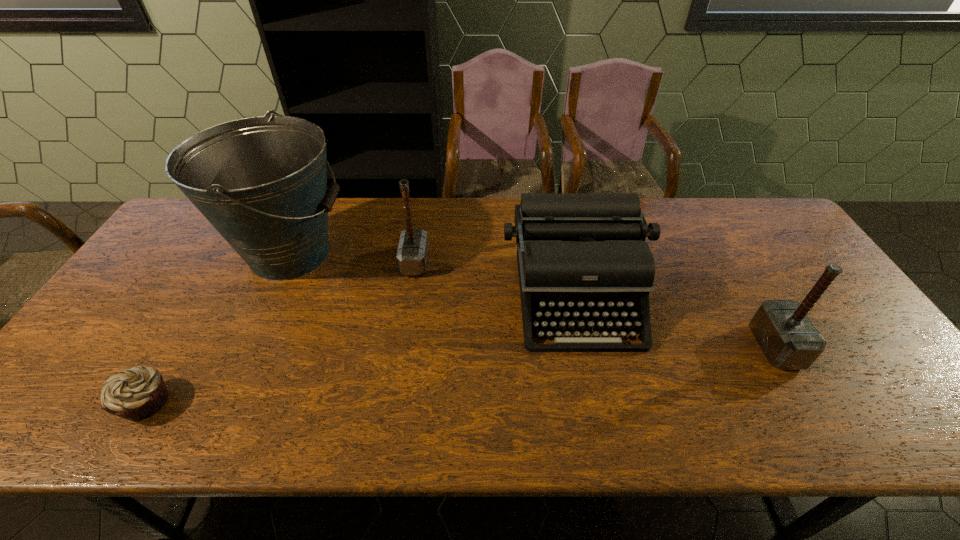
Locate an element on the screen. The height and width of the screenshot is (540, 960). blank space located 0.110m on the striking surface of the third object from left to right is located at coordinates (465, 262).

Find the location of `free point located 0.050m on the back of the rightmost object`. free point located 0.050m on the back of the rightmost object is located at coordinates (753, 309).

What are the coordinates of `vacant space located 0.130m on the typing side of the fourth tallest object` in the screenshot? It's located at (599, 400).

I want to click on vacant space situated on the left of the shortest object, so click(x=60, y=402).

Where is `object that is at the far edge`? object that is at the far edge is located at coordinates (261, 181).

You are a GUI agent. You are given a task and a screenshot of the screen. Output one action in this format:
    pyautogui.click(x=<x>, y=<y>)
    Task: Click on the object present at the near edge
    
    Given the screenshot: What is the action you would take?
    pyautogui.click(x=138, y=393)

Where is `free space at the far edge of the desktop`? This screenshot has width=960, height=540. free space at the far edge of the desktop is located at coordinates (399, 226).

Locate an element on the screen. The image size is (960, 540). free space at the near edge of the desktop is located at coordinates (843, 408).

Identify the location of vacant space at the right edge of the desktop. point(903,379).

The width and height of the screenshot is (960, 540). I want to click on vacant space at the far left corner of the desktop, so click(x=189, y=226).